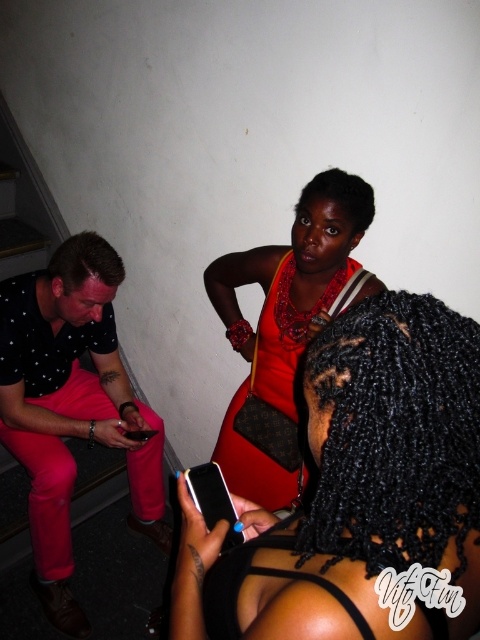
Question: Which object is farther from the camera taking this photo?

Choices:
 (A) shiny red dress at center
 (B) shiny orange fabric dress at center
 (C) polka dot fabric shirt at left

Answer: (C)

Question: Can you confirm if polka dot fabric shirt at left is positioned below shiny orange fabric dress at center?

Choices:
 (A) no
 (B) yes

Answer: (B)

Question: Can you confirm if shiny red dress at center is positioned to the right of polka dot fabric shirt at left?

Choices:
 (A) yes
 (B) no

Answer: (A)

Question: Which point is farther to the camera?

Choices:
 (A) (424, 472)
 (B) (69, 340)
 (C) (284, 499)

Answer: (B)

Question: Which object is farther from the camera taking this photo?

Choices:
 (A) shiny orange fabric dress at center
 (B) shiny red dress at center

Answer: (A)

Question: Can you confirm if shiny red dress at center is positioned to the left of polka dot fabric shirt at left?

Choices:
 (A) yes
 (B) no

Answer: (B)